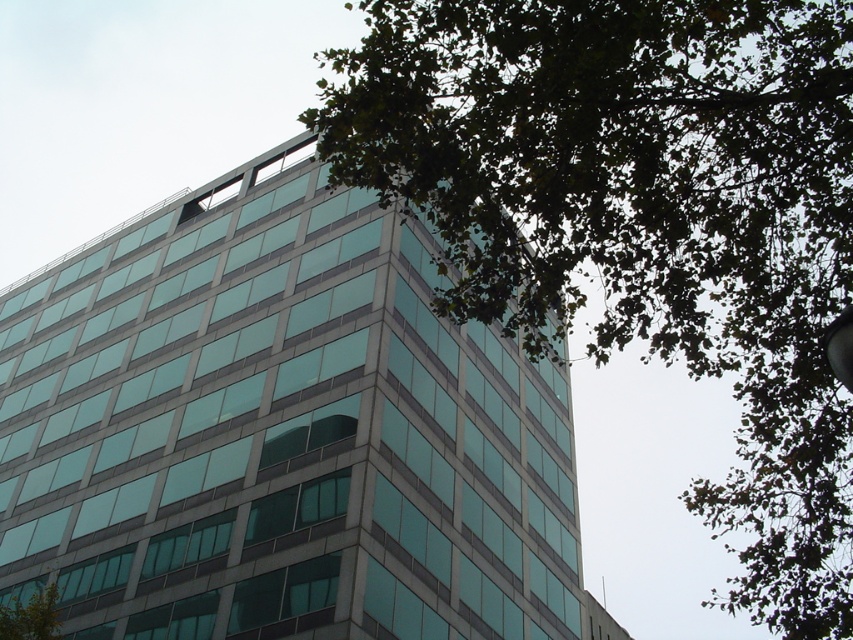
Question: Estimate the real-world distances between objects in this image. Which object is farther from the green leafy tree at lower left?

Choices:
 (A) green leafy tree at upper right
 (B) metallic silver streetlight at upper right

Answer: (A)

Question: Which of the following is the closest to the observer?

Choices:
 (A) green leafy tree at upper right
 (B) green leafy tree at lower left

Answer: (A)

Question: Is green leafy tree at lower left wider than metallic silver streetlight at upper right?

Choices:
 (A) no
 (B) yes

Answer: (B)

Question: Which point is farther from the camera taking this photo?

Choices:
 (A) (27, 582)
 (B) (844, 336)
 (C) (537, 324)

Answer: (A)

Question: Does green leafy tree at upper right lie behind green leafy tree at lower left?

Choices:
 (A) no
 (B) yes

Answer: (A)

Question: Is green leafy tree at upper right below green leafy tree at lower left?

Choices:
 (A) yes
 (B) no

Answer: (B)